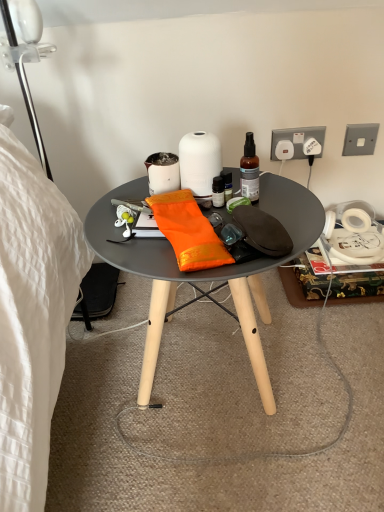
Locate an element on the screen. vacant space to the right of translucent glass spray bottle at upper right is located at coordinates (284, 197).